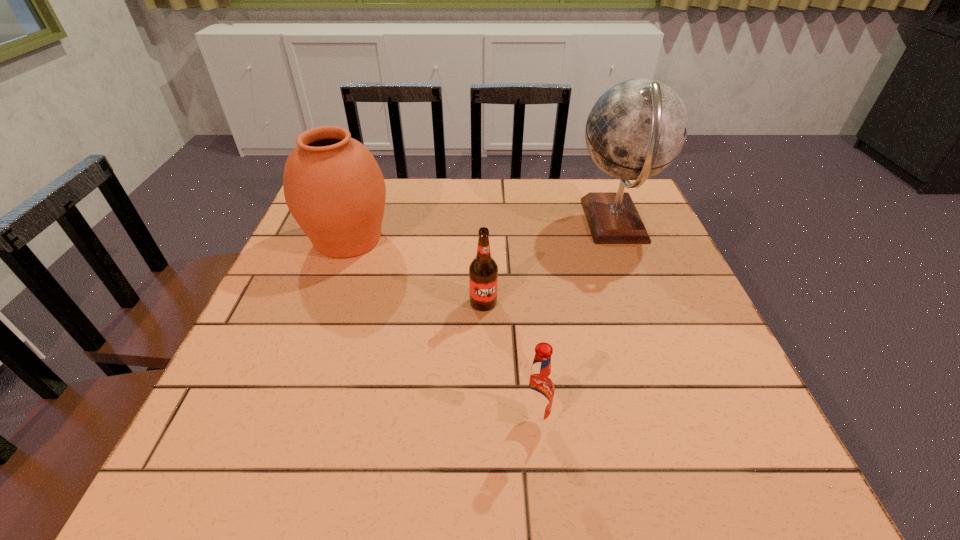
Find the location of a particular element. free space located at the equator of the rightmost object is located at coordinates (509, 222).

Where is `vacant area situated 0.110m on the right of the leftmost object`? Image resolution: width=960 pixels, height=540 pixels. vacant area situated 0.110m on the right of the leftmost object is located at coordinates (436, 239).

Find the location of a particular element. The image size is (960, 540). free spot located on the front of the left root beer is located at coordinates (484, 334).

Where is `free spot located 0.120m on the back of the nearer root beer`? free spot located 0.120m on the back of the nearer root beer is located at coordinates (527, 351).

The height and width of the screenshot is (540, 960). Find the location of `globe that is at the far edge`. globe that is at the far edge is located at coordinates (637, 128).

At what (x,y) coordinates should I click in order to perform the action: click on urn positioned at the far edge. Please return your answer as a coordinate pair (x, y). Image resolution: width=960 pixels, height=540 pixels. Looking at the image, I should click on (x=333, y=186).

At what (x,y) coordinates should I click in order to perform the action: click on object present at the near edge. Please return your answer as a coordinate pair (x, y). The height and width of the screenshot is (540, 960). Looking at the image, I should click on (538, 387).

You are a GUI agent. You are given a task and a screenshot of the screen. Output one action in this format:
    pyautogui.click(x=<x>, y=<y>)
    Task: Click on the object present at the left edge
    This screenshot has width=960, height=540.
    Given the screenshot: What is the action you would take?
    pyautogui.click(x=333, y=186)

Image resolution: width=960 pixels, height=540 pixels. In order to click on object that is at the right edge in this screenshot , I will do 637,128.

The width and height of the screenshot is (960, 540). What are the coordinates of `object present at the far left corner` in the screenshot? It's located at [x=333, y=186].